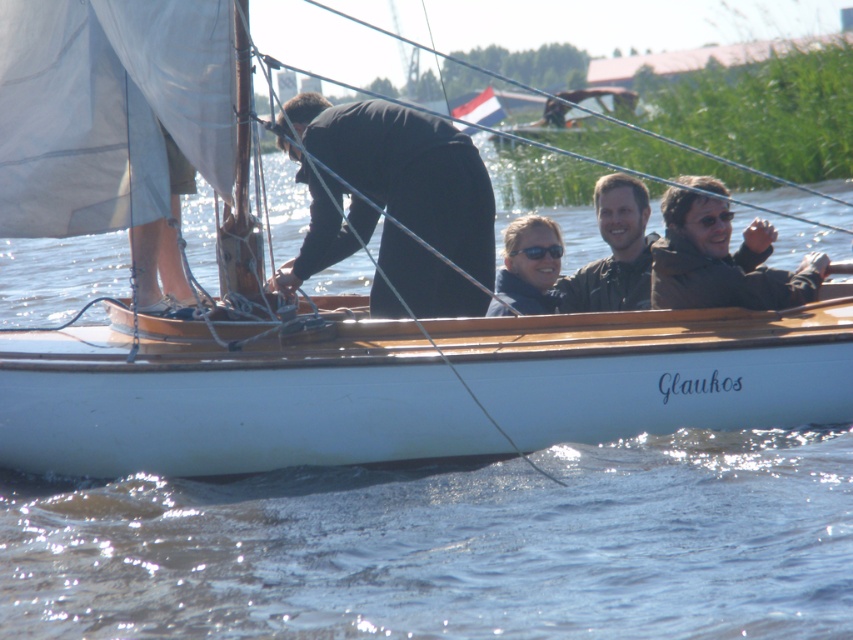
Which is behind, point (463, 141) or point (653, 252)?

The point (653, 252) is more distant.

Is black matte suit at center closer to camera compared to brown leather jacket at right?

Yes, it is in front of brown leather jacket at right.

Find the location of a particular element. Image resolution: width=853 pixels, height=640 pixels. black matte suit at center is located at coordinates (408, 172).

Which is above, black matte suit at center or matte black jacket at center?

black matte suit at center is above.

Image resolution: width=853 pixels, height=640 pixels. Describe the element at coordinates (408, 172) in the screenshot. I see `black matte suit at center` at that location.

Where is `black matte suit at center`? This screenshot has width=853, height=640. black matte suit at center is located at coordinates (408, 172).

Is point (729, 262) farther from camera compared to point (515, 301)?

No, (729, 262) is closer to viewer.

Is brown leather jacket at right closer to the viewer compared to sunglasses matte at center?

Yes, it is in front of sunglasses matte at center.

Image resolution: width=853 pixels, height=640 pixels. What do you see at coordinates (722, 260) in the screenshot?
I see `brown leather jacket at right` at bounding box center [722, 260].

This screenshot has width=853, height=640. Identify the location of brown leather jacket at right. (722, 260).